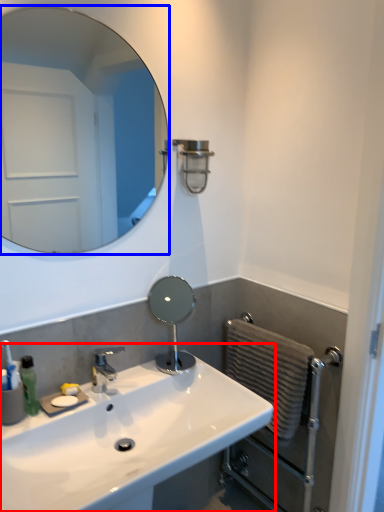
Question: Which object is closer to the camera taking this photo, sink (highlighted by a red box) or mirror (highlighted by a blue box)?

Choices:
 (A) sink
 (B) mirror

Answer: (A)